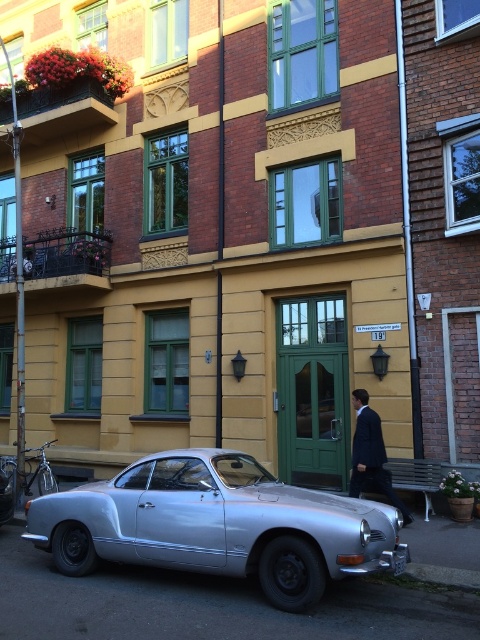
Question: Can you confirm if silver metallic car at center is positioned to the left of dark blue suit at center?

Choices:
 (A) no
 (B) yes

Answer: (B)

Question: Is silver metallic car at center to the right of dark blue suit at center from the viewer's perspective?

Choices:
 (A) no
 (B) yes

Answer: (A)

Question: Is silver metallic car at center below dark blue suit at center?

Choices:
 (A) no
 (B) yes

Answer: (B)

Question: Which of the following is the closest to the observer?

Choices:
 (A) (365, 420)
 (B) (73, 492)

Answer: (B)

Question: Which object appears farthest from the camera in this image?

Choices:
 (A) dark blue suit at center
 (B) silver metallic car at center

Answer: (A)

Question: Which point is farther from the camera taking this photo?

Choices:
 (A) (307, 595)
 (B) (372, 456)

Answer: (B)